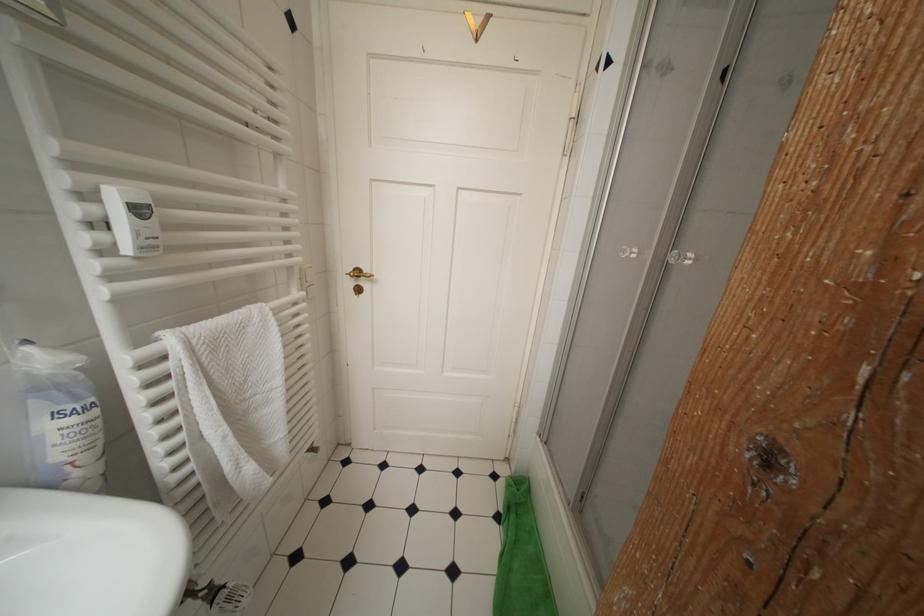
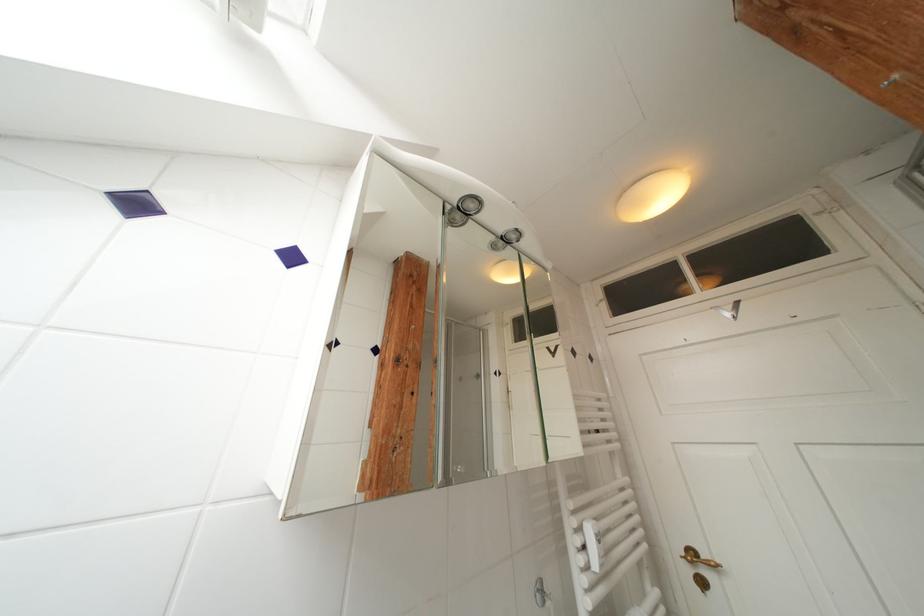
Locate, in the second image, the point that corresponds to [95,199] in the first image.

(586, 533)